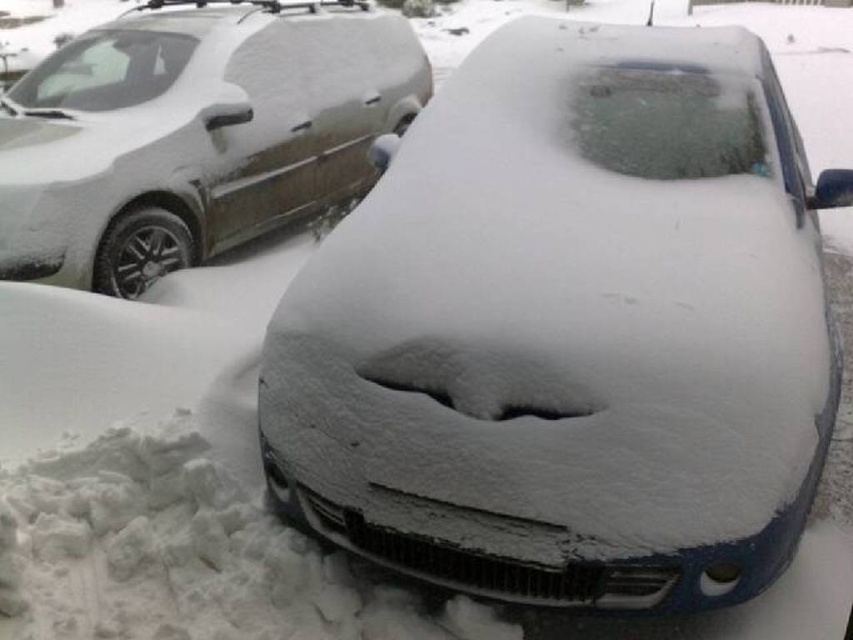
Can you confirm if snow-covered car at center is thinner than sleek silver van at upper left?

Indeed, snow-covered car at center has a lesser width compared to sleek silver van at upper left.

Between point (769, 97) and point (289, 102), which one is positioned in front?

Point (769, 97) is more forward.

Is point (793, 205) less distant than point (346, 58)?

Yes, point (793, 205) is closer to viewer.

The width and height of the screenshot is (853, 640). Identify the location of snow-covered car at center. (569, 330).